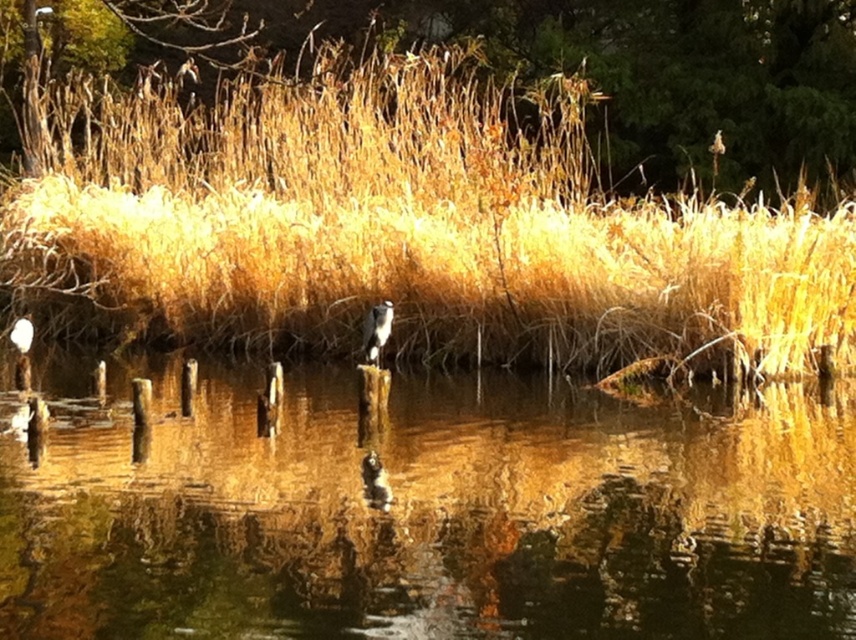
Question: Can you confirm if brown reflective water at center is wider than white fluffy bird at center?

Choices:
 (A) no
 (B) yes

Answer: (B)

Question: In this image, where is brown reflective water at center located relative to brown grass at upper center?

Choices:
 (A) below
 (B) above

Answer: (A)

Question: Which point appears farthest from the camera in this image?

Choices:
 (A) (369, 332)
 (B) (173, 54)
 (C) (122, 340)
 (D) (62, 612)

Answer: (B)

Question: Which object is the farthest from the brown grass at upper center?

Choices:
 (A) brown reflective water at center
 (B) dry grass at upper center

Answer: (A)

Question: Can you confirm if brown reflective water at center is thinner than brown grass at upper center?

Choices:
 (A) no
 (B) yes

Answer: (B)

Question: Which point appears closest to the camera in this image?

Choices:
 (A) (660, 140)
 (B) (363, 349)

Answer: (B)